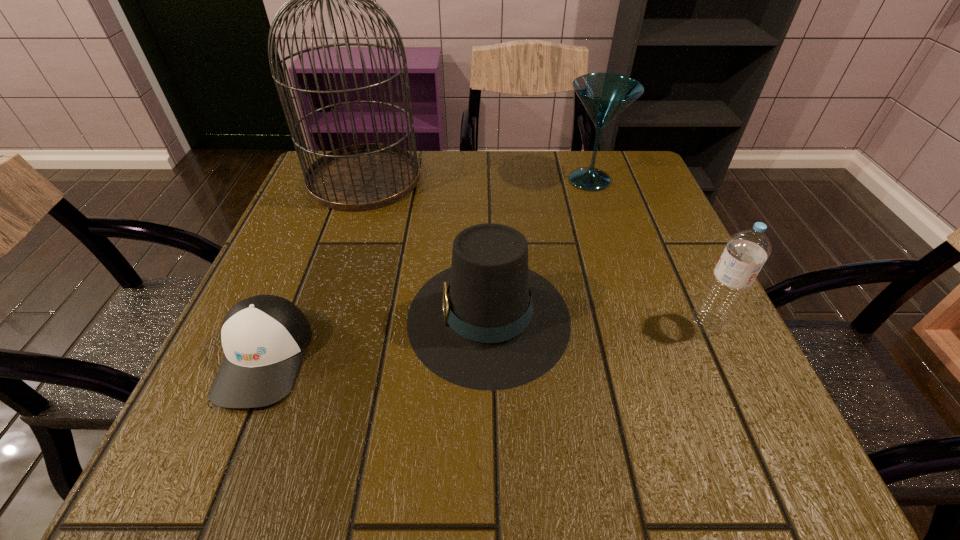
Identify the location of object that is positioned at the far right corner. (x=604, y=95).

Locate an element on the screen. This screenshot has width=960, height=540. free space at the far edge is located at coordinates (423, 188).

Identify the location of vacant space at the near edge. (593, 462).

You are a GUI agent. You are given a task and a screenshot of the screen. Output one action in this format:
    pyautogui.click(x=<x>, y=<y>)
    Task: Click on the free space at the left edge
    
    Given the screenshot: What is the action you would take?
    pyautogui.click(x=293, y=215)

Identify the location of free point at the right edge. Image resolution: width=960 pixels, height=540 pixels. (684, 258).

Where is `vacant region at the far right corner of the desktop`? The height and width of the screenshot is (540, 960). vacant region at the far right corner of the desktop is located at coordinates (638, 180).

Identify the location of empty location between the martini and the water bottle. This screenshot has height=540, width=960. (649, 251).

I want to click on vacant area that lies between the water bottle and the second object from right to left, so click(649, 251).

Where is `vacant space that's between the tallest object and the water bottle`? This screenshot has width=960, height=540. vacant space that's between the tallest object and the water bottle is located at coordinates [536, 251].

Identify the location of free area in between the rightmost object and the martini. (649, 251).